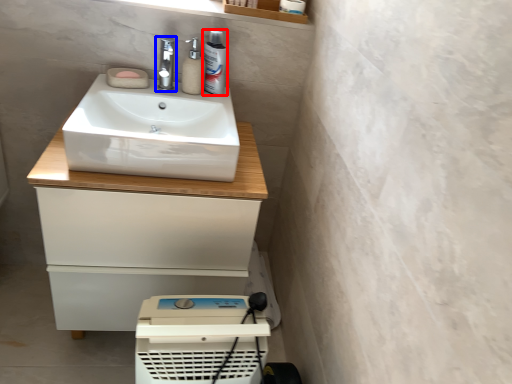
Question: Which of the following is the closest to the observer, mouthwash (highlighted by a red box) or tap (highlighted by a blue box)?

Choices:
 (A) mouthwash
 (B) tap

Answer: (B)